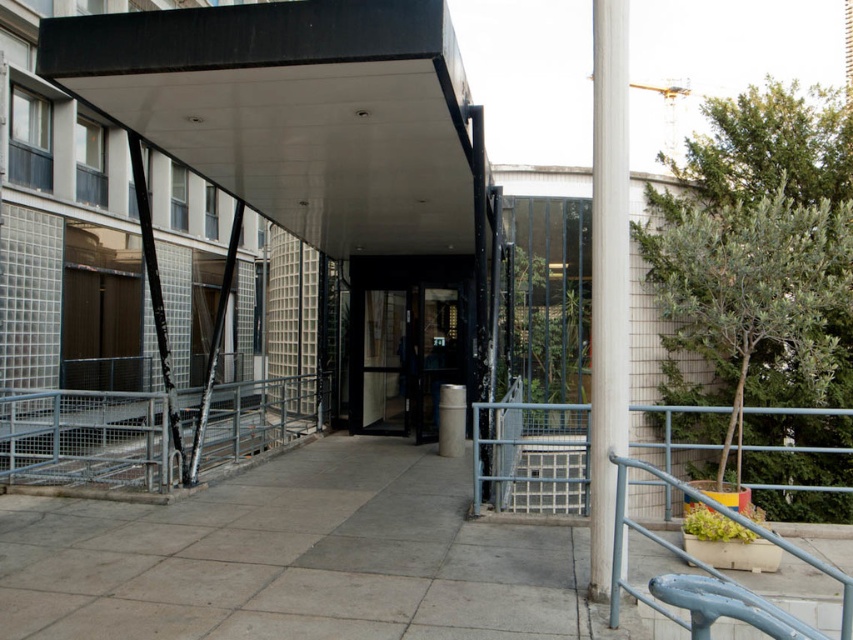
Question: Which of these objects is positioned farthest from the blue painted metal railing at lower right?

Choices:
 (A) metal/grey rail at lower left
 (B) white glossy pole at right

Answer: (A)

Question: Which point is closer to the camera?

Choices:
 (A) transparent glass door at center
 (B) metallic grid stair at center

Answer: (A)

Question: Among these points, which one is farthest from the camera?

Choices:
 (A) (22, 476)
 (B) (402, 307)

Answer: (B)

Question: Does transparent glass door at center appear over white glossy pole at right?

Choices:
 (A) no
 (B) yes

Answer: (A)

Question: Is white glossy pole at right to the right of blue painted metal railing at lower right from the viewer's perspective?

Choices:
 (A) yes
 (B) no

Answer: (B)

Question: Where is transparent glass door at center located in relation to metallic grid stair at center in the image?

Choices:
 (A) left
 (B) right

Answer: (A)